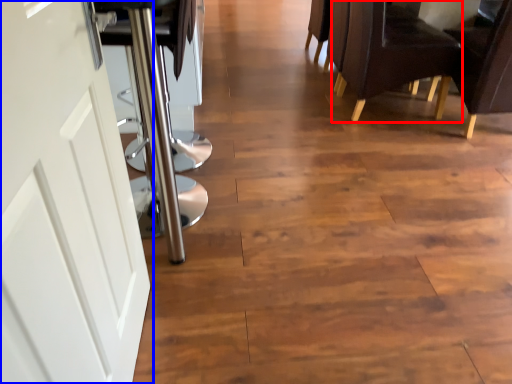
Question: Among these objects, which one is nearest to the camera, chair (highlighted by a red box) or door (highlighted by a blue box)?

Choices:
 (A) chair
 (B) door

Answer: (B)